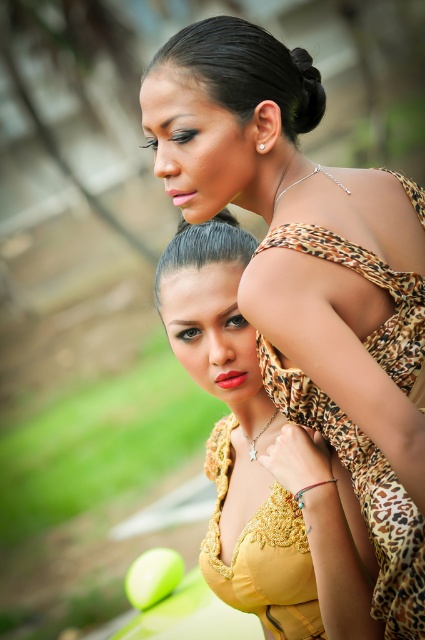
From the picture: You are standing in a garden and see two women. The first woman is wearing a yellow embroidered top with a star pendant necklace, and the second woman is wearing a leopard print off the shoulder top. There is a point at coordinates (311, 276). Which woman is this point closer to?

The point at (311, 276) is on the leopard print dress at upper center, so it is closer to the second woman wearing the leopard print off the shoulder top.

You are a photographer trying to capture a photo of both women in the scene. You notice two points marked in the image. The first point is at coordinate point(390, 499) and the second is at point(306, 563). Which point is closer to the camera?

Point(390, 499) is in front of point(306, 563), so it is closer to the camera.

You are standing in the garden and want to take a photo of both women. You notice two points marked in the image at coordinates point [167,161] and point [299,99]. Which point should you focus on to ensure both women are in clear focus?

Point [167,161] is in front of point [299,99]. To ensure both women are in clear focus, you should focus on the point that is closer to the camera, which is point [167,161]. This will help keep both subjects sharp since the foreground point is nearer.